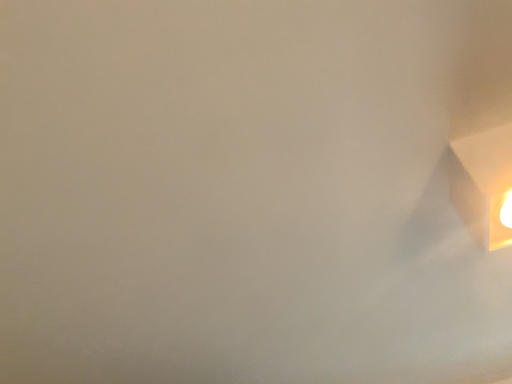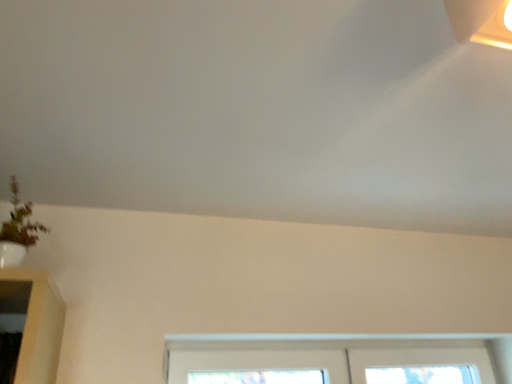
Question: How did the camera likely rotate when shooting the video?

Choices:
 (A) rotated right
 (B) rotated left

Answer: (A)